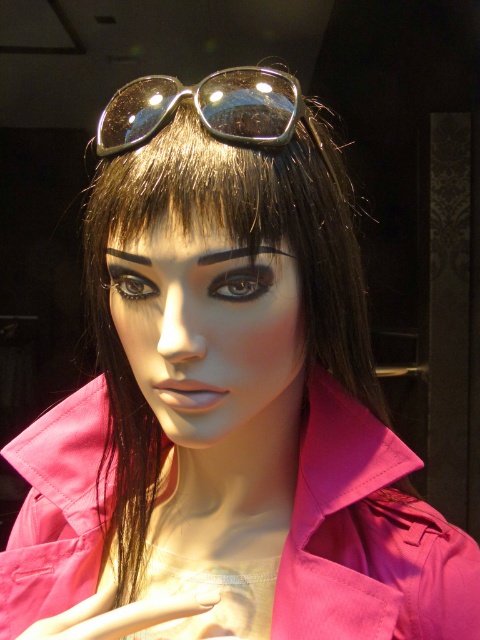
From the picture: Can you confirm if black matte eyebrow at center is shorter than black matte eyebrow at upper center?

No, black matte eyebrow at center is not shorter than black matte eyebrow at upper center.

Which is more to the right, black matte eyebrow at center or black matte eyebrow at upper center?

Positioned to the right is black matte eyebrow at center.

Is point (204, 262) positioned in front of point (119, 257)?

Yes, it is.

I want to click on black matte eyebrow at center, so click(x=239, y=253).

Does point (278, 356) lie in front of point (233, 250)?

No, (278, 356) is further to viewer.

Does smooth matte face at center have a greater height compared to black matte eyebrow at center?

Yes.

Identify the location of smooth matte face at center. (212, 336).

Can you confirm if shiny black goggles at upper center is smaller than black matte eyebrow at upper center?

No.

Locate an element on the screen. shiny black goggles at upper center is located at coordinates (206, 108).